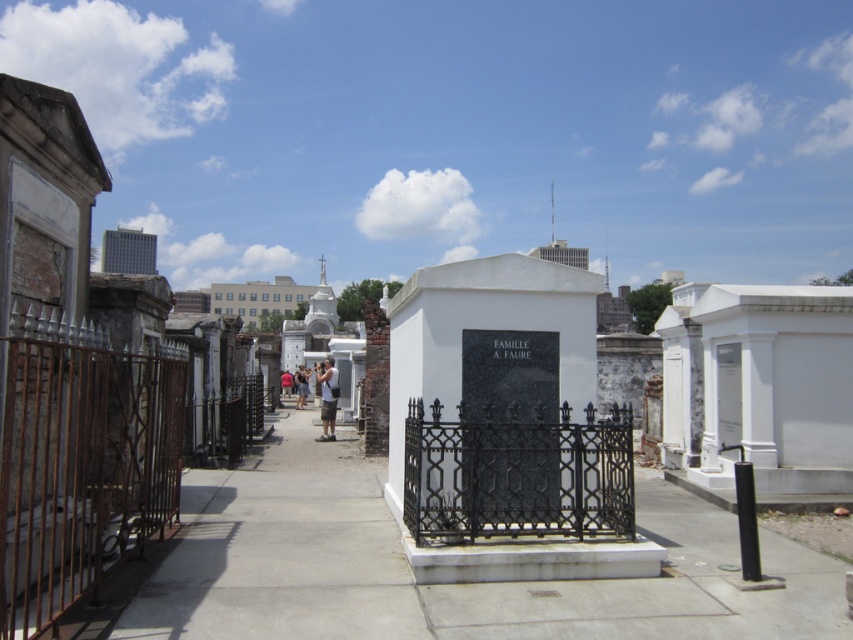
Question: Which of the following is the closest to the observer?

Choices:
 (A) camouflage shorts at center
 (B) white concrete pavement at center
 (C) black wrought iron fence at center
 (D) rusty iron fence at left

Answer: (D)

Question: From the image, what is the correct spatial relationship of white concrete pavement at center in relation to red shirt at center?

Choices:
 (A) left
 (B) right

Answer: (B)

Question: Is white concrete pavement at center thinner than black wrought iron fence at center?

Choices:
 (A) yes
 (B) no

Answer: (B)

Question: Which object is the closest to the camouflage shorts at center?

Choices:
 (A) white concrete pavement at center
 (B) black wrought iron fence at center

Answer: (A)

Question: In this image, where is white concrete pavement at center located relative to red shirt at center?

Choices:
 (A) left
 (B) right

Answer: (B)

Question: Which of these objects is positioned closest to the red shirt at center?

Choices:
 (A) rusty iron fence at left
 (B) light brown leather jacket at center

Answer: (B)